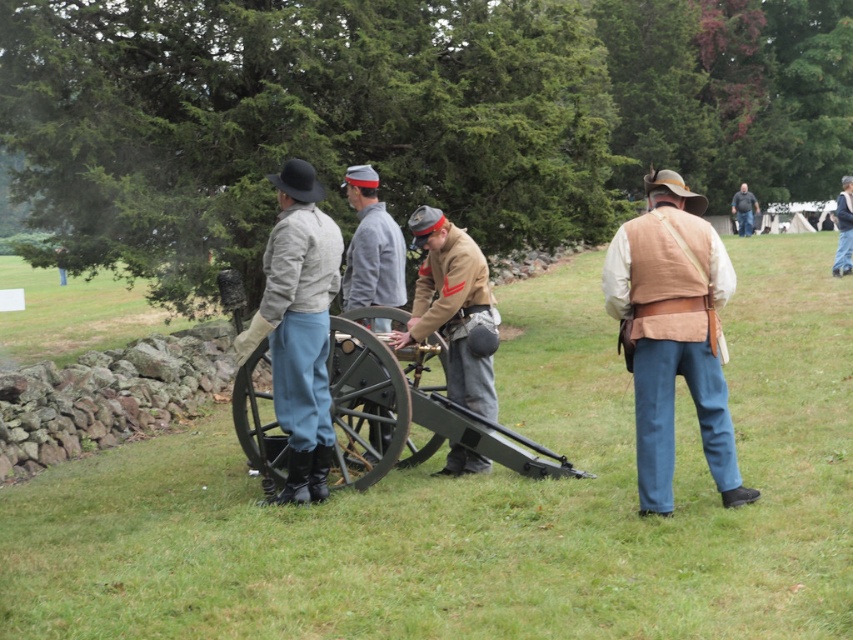
Question: Does tan leather vest at center have a smaller size compared to light beige fabric uniform at center?

Choices:
 (A) yes
 (B) no

Answer: (B)

Question: Based on their relative distances, which object is farther from the green matte cannon at center?

Choices:
 (A) dark gray jacket at center
 (B) brown leather jacket at center
 (C) tan leather jacket at center

Answer: (A)

Question: Which point is farther to the camera?

Choices:
 (A) dark gray jacket at center
 (B) green matte cannon at center
 (C) tan leather jacket at center

Answer: (A)

Question: Is tan leather vest at center bigger than green matte cannon at center?

Choices:
 (A) yes
 (B) no

Answer: (B)

Question: Observing the image, what is the correct spatial positioning of tan leather jacket at center in reference to dark gray jacket at center?

Choices:
 (A) left
 (B) right

Answer: (A)

Question: Among these objects, which one is nearest to the camera?

Choices:
 (A) brown leather jacket at center
 (B) tan leather vest at center

Answer: (B)